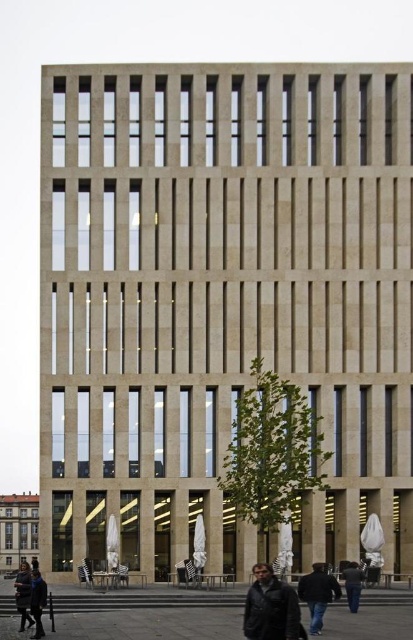
You are a photographer planning to take a photo of the dark blue jacket at center and the dark brown leather jacket at lower left. Which jacket should you focus on first if you want to include both in your frame without moving the camera, considering their heights?

The dark blue jacket at center is shorter than the dark brown leather jacket at lower left, so you should focus on the dark brown leather jacket at lower left first to ensure both are in the frame since it is taller and might require adjusting the angle to include the shorter jacket.

Consider the image. You are a photographer positioned at the entrance of the building. You notice two jackets on the plaza. Which jacket, the dark gray leather jacket at lower center or the dark blue leather jacket at lower left, is positioned to the right from your viewpoint?

The dark gray leather jacket at lower center is positioned to the right of the dark blue leather jacket at lower left from your viewpoint.